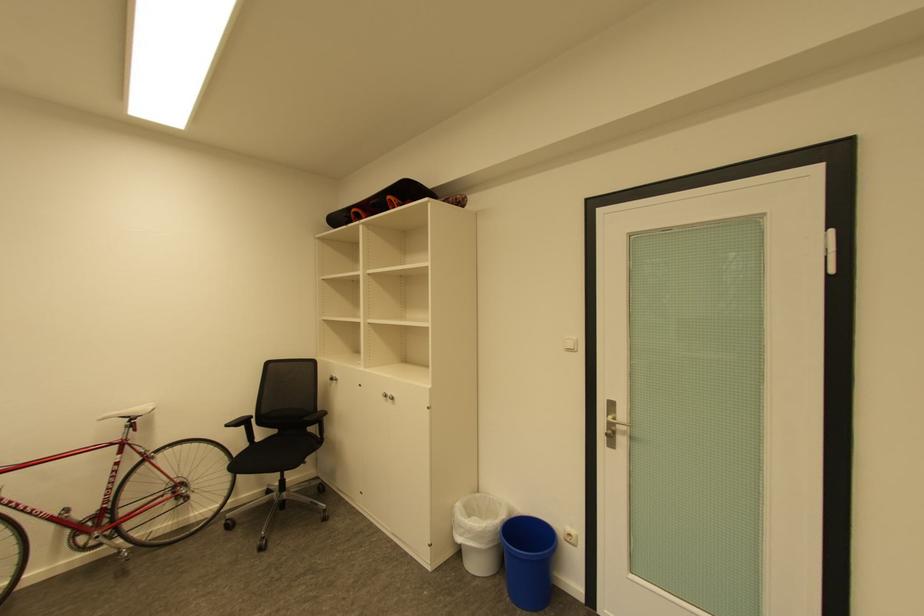
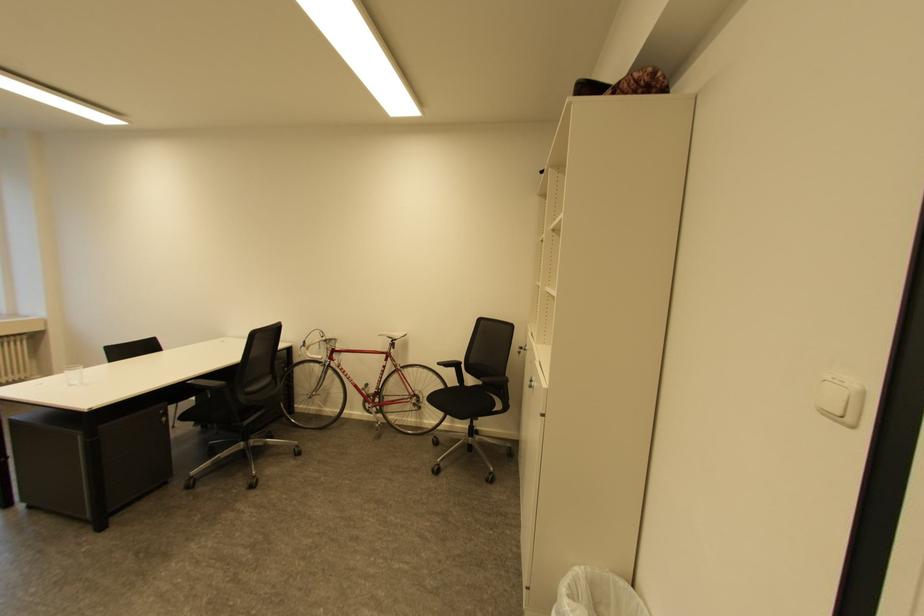
The point at (x=464, y=505) is marked in the first image. Where is the corresponding point in the second image?

(579, 569)